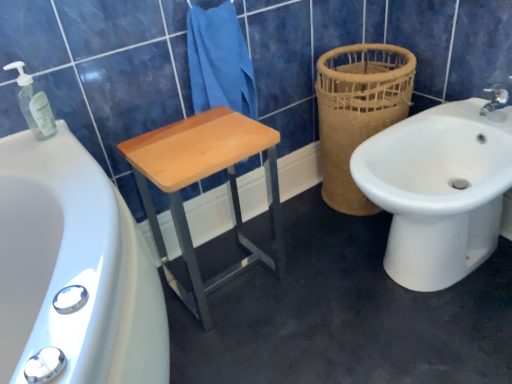
I want to click on free location to the right of light wood/matte stool at center, so click(x=310, y=270).